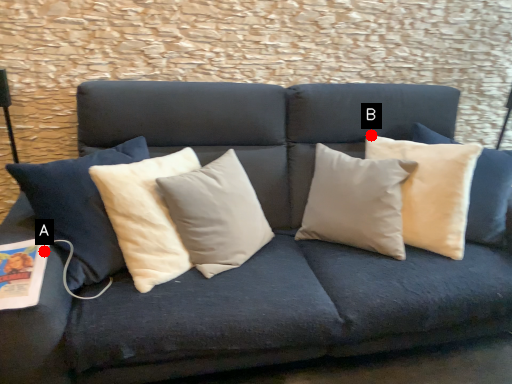
Question: Two points are circled on the image, labeled by A and B beside each circle. Among these points, which one is farthest from the camera?

Choices:
 (A) A is further
 (B) B is further

Answer: (B)